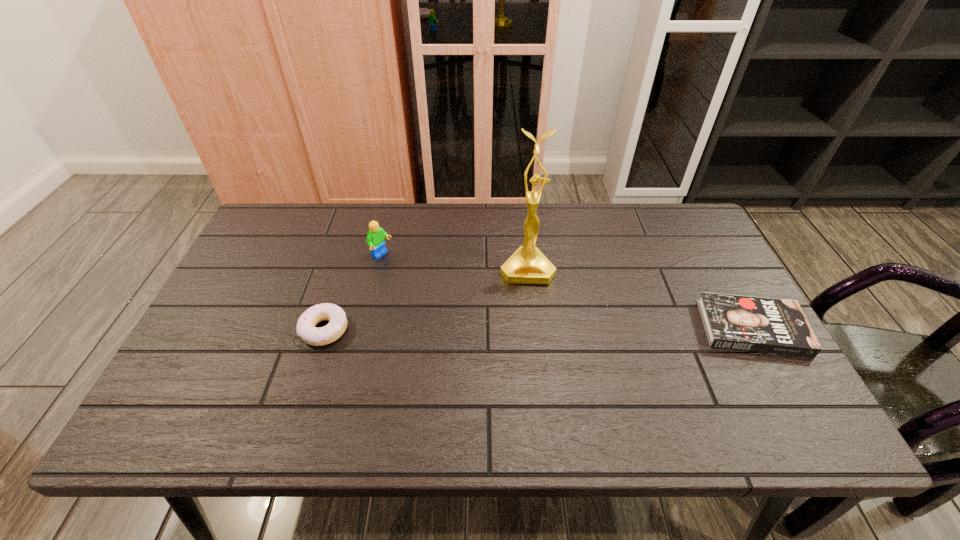
Find the location of a particular element. The height and width of the screenshot is (540, 960). the leftmost object is located at coordinates (306, 329).

You are a GUI agent. You are given a task and a screenshot of the screen. Output one action in this format:
    pyautogui.click(x=<x>, y=<y>)
    Task: Click on the doughnut
    The width and height of the screenshot is (960, 540).
    Given the screenshot: What is the action you would take?
    pyautogui.click(x=306, y=329)

Locate an element on the screen. This screenshot has height=540, width=960. the shortest object is located at coordinates (756, 324).

You are a GUI agent. You are given a task and a screenshot of the screen. Output one action in this format:
    pyautogui.click(x=<x>, y=<y>)
    Task: Click on the book
    
    Given the screenshot: What is the action you would take?
    pyautogui.click(x=756, y=324)

The height and width of the screenshot is (540, 960). Find the location of `the tallest object`. the tallest object is located at coordinates [x=527, y=265].

Identify the location of award. coord(527,265).

Locate an element on the screen. Image resolution: width=960 pixels, height=540 pixels. the third object from right to left is located at coordinates (375, 239).

Find the location of a particular element. Image resolution: width=960 pixels, height=540 pixels. Lego is located at coordinates (375, 239).

This screenshot has width=960, height=540. In order to click on vacant area situated 0.240m on the left of the third tallest object in this screenshot , I will do `click(205, 329)`.

In order to click on vacant space located 0.330m on the left of the rightmost object in this screenshot , I will do `click(570, 328)`.